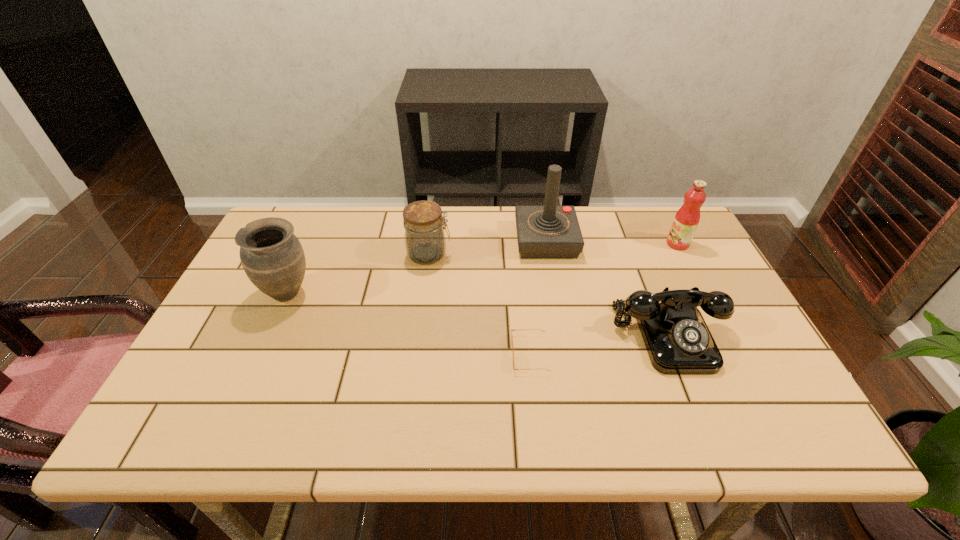
Find the location of a particular element. The height and width of the screenshot is (540, 960). fruit juice at the far edge is located at coordinates (686, 220).

The width and height of the screenshot is (960, 540). Identify the location of jar that is at the far edge. (425, 242).

You are a GUI agent. You are given a task and a screenshot of the screen. Output one action in this format:
    pyautogui.click(x=<x>, y=<y>)
    Task: Click on the object located at the left edge
    The image size is (960, 540).
    Given the screenshot: What is the action you would take?
    pyautogui.click(x=271, y=255)

What are the coordinates of `fruit juice present at the right edge` in the screenshot? It's located at (686, 220).

Image resolution: width=960 pixels, height=540 pixels. What are the coordinates of `telephone located at the right edge` in the screenshot? It's located at (678, 341).

Locate an element on the screen. The image size is (960, 540). object at the far right corner is located at coordinates (686, 220).

At what (x,y) coordinates should I click in order to perform the action: click on vacant space at the far edge of the desktop. Please return your answer as a coordinate pair (x, y). Looking at the image, I should click on (509, 206).

The height and width of the screenshot is (540, 960). In the image, there is a desktop. In order to click on vacant space at the near edge in this screenshot , I will do `click(268, 425)`.

The width and height of the screenshot is (960, 540). In the image, there is a desktop. Identify the location of vacant space at the right edge. (740, 370).

The width and height of the screenshot is (960, 540). Identify the location of vacant space that's between the sunglasses and the third shortest object. (479, 304).